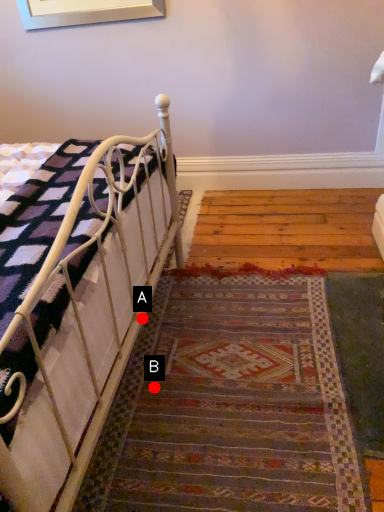
Question: Two points are circled on the image, labeled by A and B beside each circle. Which point is farther to the camera?

Choices:
 (A) A is further
 (B) B is further

Answer: (A)